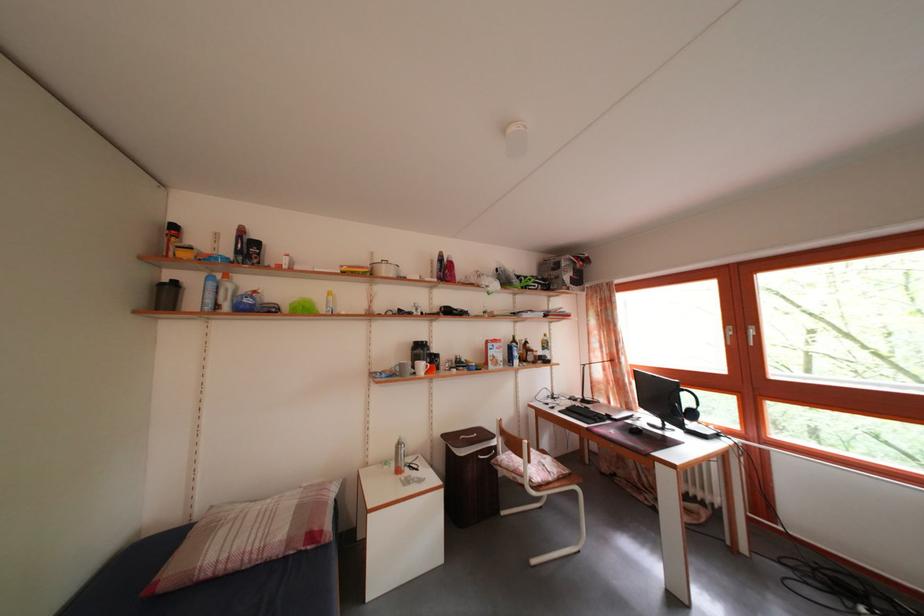
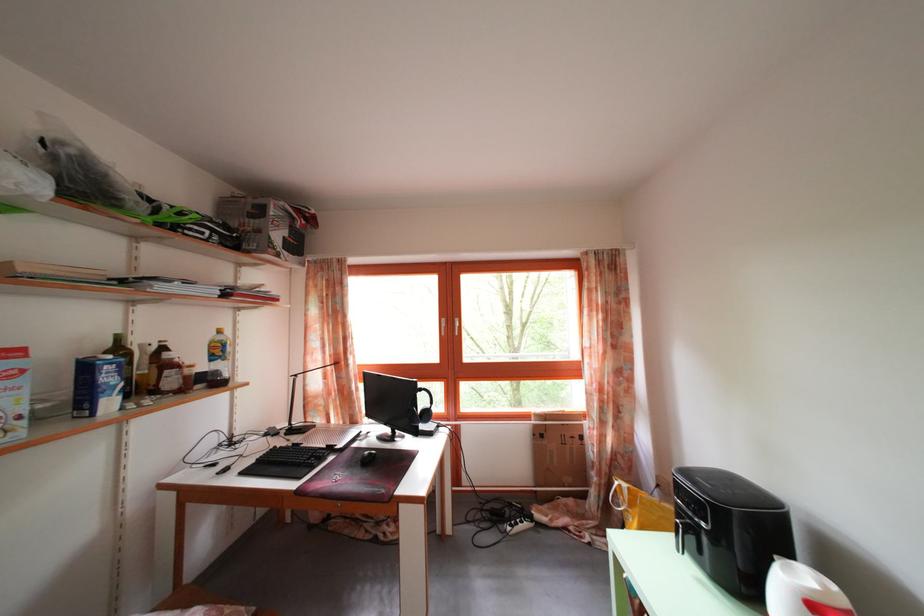
Find the pixel in the second image that matches [637,429] in the first image.

(363, 451)